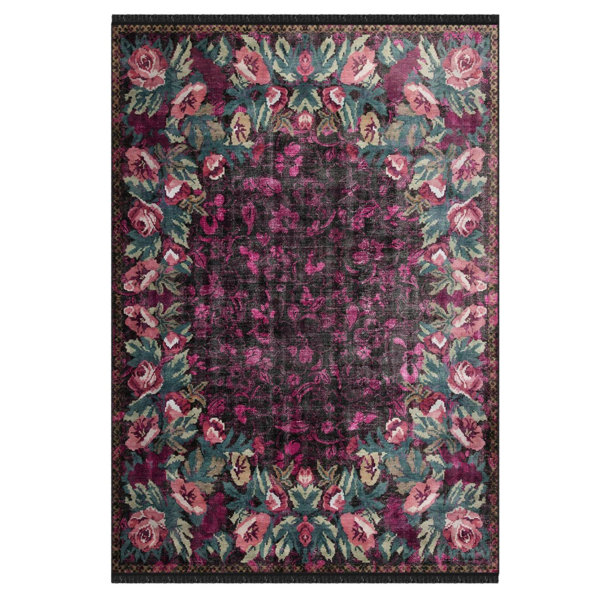
What are the coordinates of `fringes on the rug` in the screenshot? It's located at (245, 577), (258, 18).